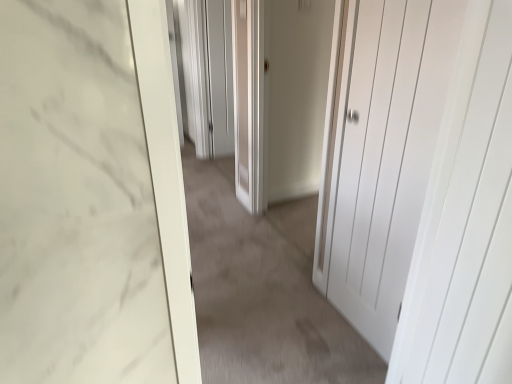
Question: Can you confirm if matte gray screen door at center is shorter than white matte door at center, which is counted as the second door, starting from the left?

Choices:
 (A) no
 (B) yes

Answer: (B)

Question: Is matte gray screen door at center to the left of white matte door at center, which is counted as the second door, starting from the left, from the viewer's perspective?

Choices:
 (A) no
 (B) yes

Answer: (B)

Question: Is matte gray screen door at center positioned with its back to white matte door at center, arranged as the 1th door when viewed from the right?

Choices:
 (A) no
 (B) yes

Answer: (A)

Question: Is matte gray screen door at center thinner than white matte door at center, which is counted as the second door, starting from the left?

Choices:
 (A) no
 (B) yes

Answer: (A)

Question: Is white matte door at center, arranged as the 1th door when viewed from the right, a part of matte gray screen door at center?

Choices:
 (A) no
 (B) yes

Answer: (A)

Question: Would you say matte gray screen door at center is a long distance from white matte door at center, which is counted as the second door, starting from the left?

Choices:
 (A) yes
 (B) no

Answer: (A)

Question: Does white matte door at center, which appears as the first door when viewed from the left, have a greater height compared to matte gray screen door at center?

Choices:
 (A) yes
 (B) no

Answer: (A)

Question: Can you confirm if white matte door at center, which appears as the first door when viewed from the left, is thinner than matte gray screen door at center?

Choices:
 (A) no
 (B) yes

Answer: (A)

Question: Is white matte door at center, the second door positioned from the right, outside of matte gray screen door at center?

Choices:
 (A) no
 (B) yes

Answer: (B)

Question: Is white matte door at center, the second door positioned from the right, closer to the viewer compared to matte gray screen door at center?

Choices:
 (A) yes
 (B) no

Answer: (A)

Question: Is matte gray screen door at center surrounded by white matte door at center, which appears as the first door when viewed from the left?

Choices:
 (A) no
 (B) yes

Answer: (A)

Question: Is white matte door at center, which appears as the first door when viewed from the left, at the left side of matte gray screen door at center?

Choices:
 (A) yes
 (B) no

Answer: (B)

Question: Considering the relative positions of white matte door at center and white matte door at center, which appears as the first door when viewed from the left, in the image provided, is white matte door at center to the left of white matte door at center, which appears as the first door when viewed from the left, from the viewer's perspective?

Choices:
 (A) no
 (B) yes

Answer: (B)